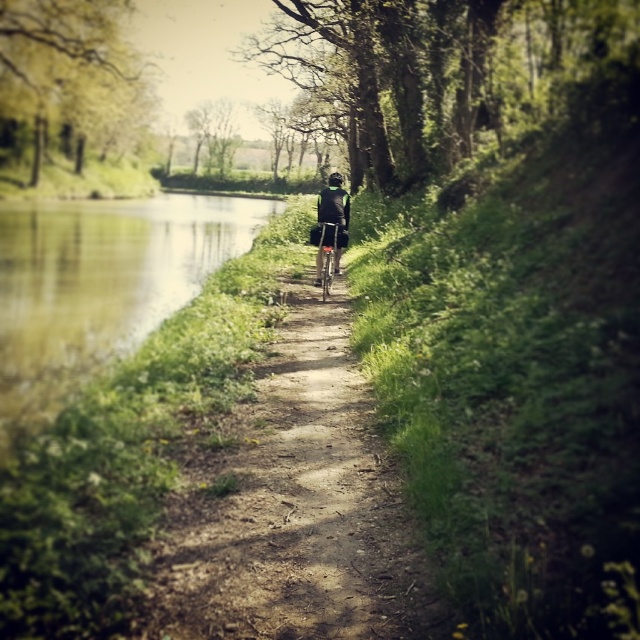
You are a photographer planning to capture the metallic silver bicycle at center and the black matte helmet at center in a single frame. Considering their widths, which object should you position closer to the camera to ensure both fit within the frame?

The metallic silver bicycle at center has a lesser width compared to the black matte helmet at center. To ensure both fit within the frame, position the wider black matte helmet at center closer to the camera since it requires more space, allowing the narrower bicycle to occupy less area.